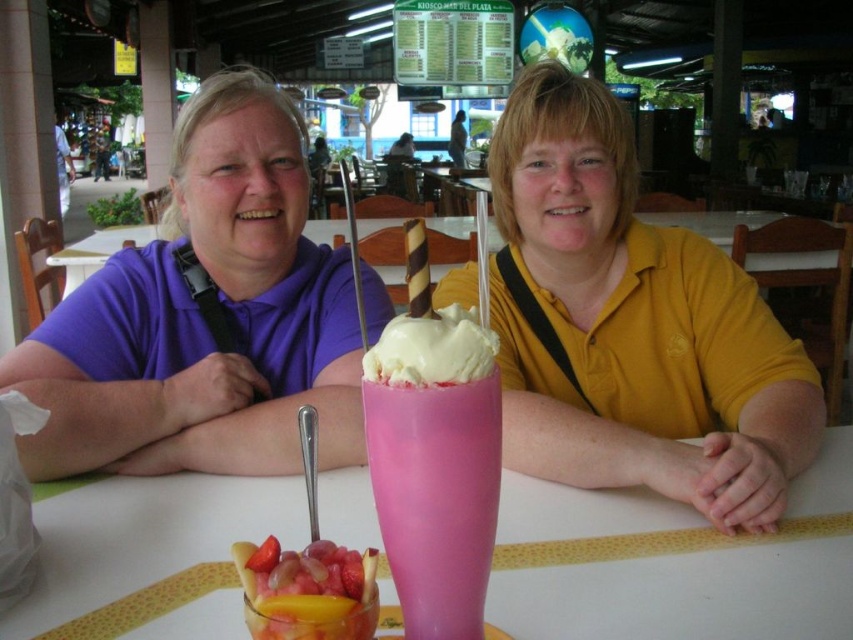
Which is more to the left, translucent glass at center or pink plastic cup at center?

pink plastic cup at center

Can you confirm if translucent glass at center is bigger than pink plastic cup at center?

Yes.

What are the coordinates of `translucent glass at center` in the screenshot? It's located at pos(672,563).

Who is higher up, purple matte shirt at center or pink plastic cup at center?

purple matte shirt at center

Identify the location of purple matte shirt at center. The width and height of the screenshot is (853, 640). (x=206, y=317).

Does yellow matte shirt at center come behind glossy plastic fruit salad at center?

Yes.

Is point (520, 451) farther from camera compared to point (318, 582)?

Yes, point (520, 451) is behind point (318, 582).

You are a GUI agent. You are given a task and a screenshot of the screen. Output one action in this format:
    pyautogui.click(x=<x>, y=<y>)
    Task: Click on the yellow matte shirt at center
    The height and width of the screenshot is (640, 853).
    Given the screenshot: What is the action you would take?
    pyautogui.click(x=631, y=324)